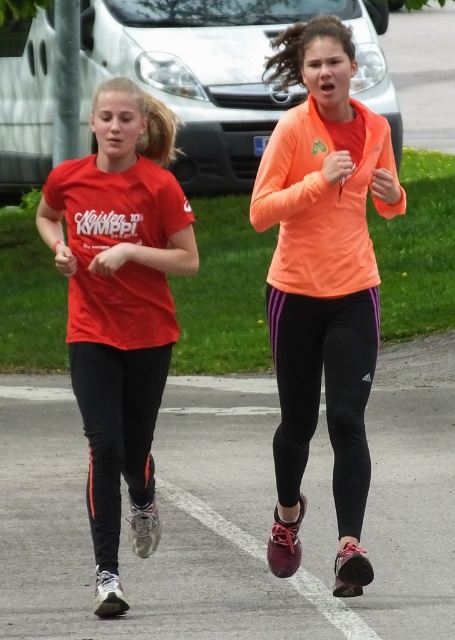
Who is positioned more to the right, orange matte long-sleeve shirt at center or matte red t-shirt at left?

Positioned to the right is orange matte long-sleeve shirt at center.

Where is `orange matte long-sleeve shirt at center`? The height and width of the screenshot is (640, 455). orange matte long-sleeve shirt at center is located at coordinates (323, 282).